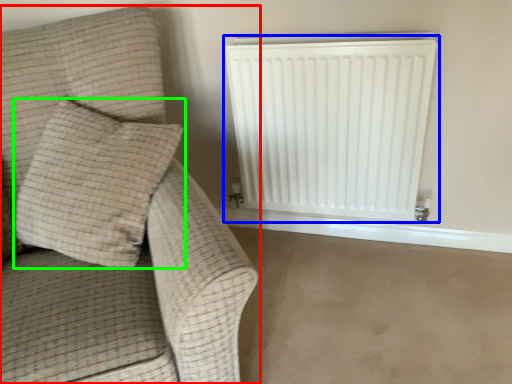
Question: Considering the real-world distances, which object is farthest from furniture (highlighted by a red box)? radiator (highlighted by a blue box) or pillow (highlighted by a green box)?

Choices:
 (A) radiator
 (B) pillow

Answer: (A)